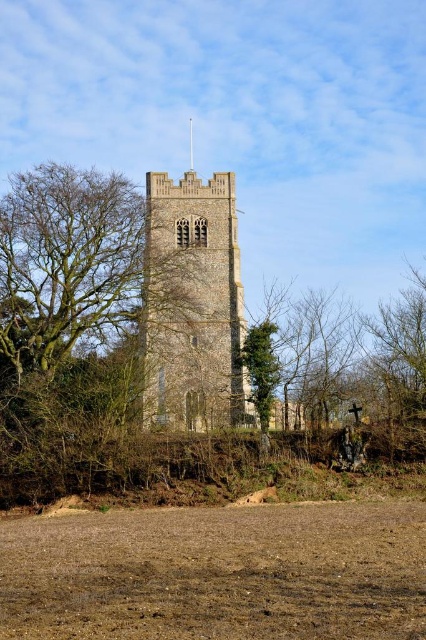
You are a gardener planning to plant a new tree that requires at least 70 feet of space between it and the existing green leafy tree at center. You have a spot near the brown soil at lower center. Will this location meet the spacing requirement?

The distance between the brown soil at lower center and the green leafy tree at center is 69.65 feet, which is slightly less than the required 70 feet. Therefore, planting the new tree at the brown soil at lower center would not meet the spacing requirement.

You are standing in the field near the historic stone church tower and see the stone tower at center and the green leafy tree at center. Which object appears bigger in the scene?

The stone tower at center is larger in size than the green leafy tree at center, so the stone tower at center appears bigger.

You are a gardener planning to plant a new tree in the area shown in the image. The tree you want to plant requires a space that is wider than the brown soil at lower center. Based on the scene, can the green leafy tree at center provide enough space for this new tree?

The brown soil at lower center might be wider than green leafy tree at center, so it is uncertain if the green leafy tree at center can provide enough space for the new tree that requires a wider area.